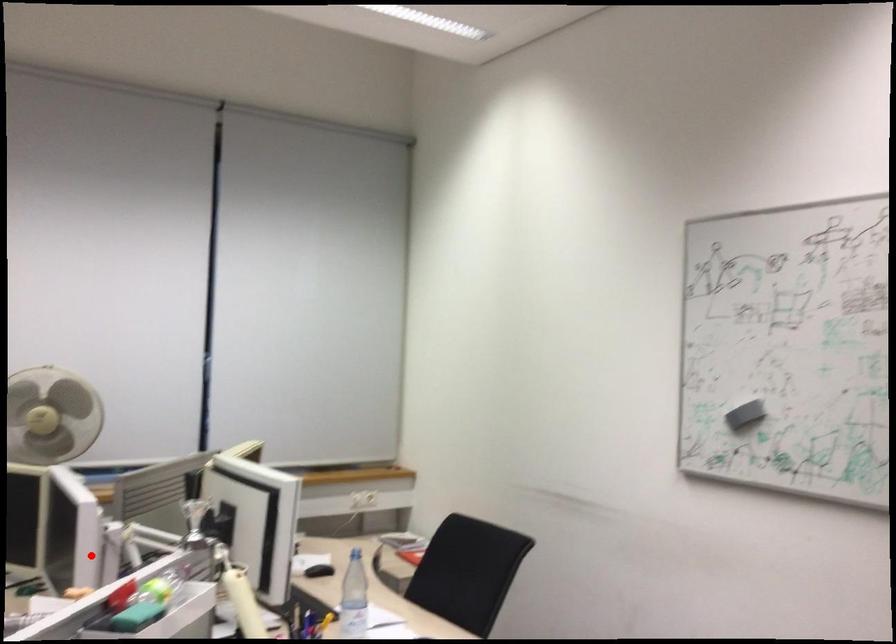
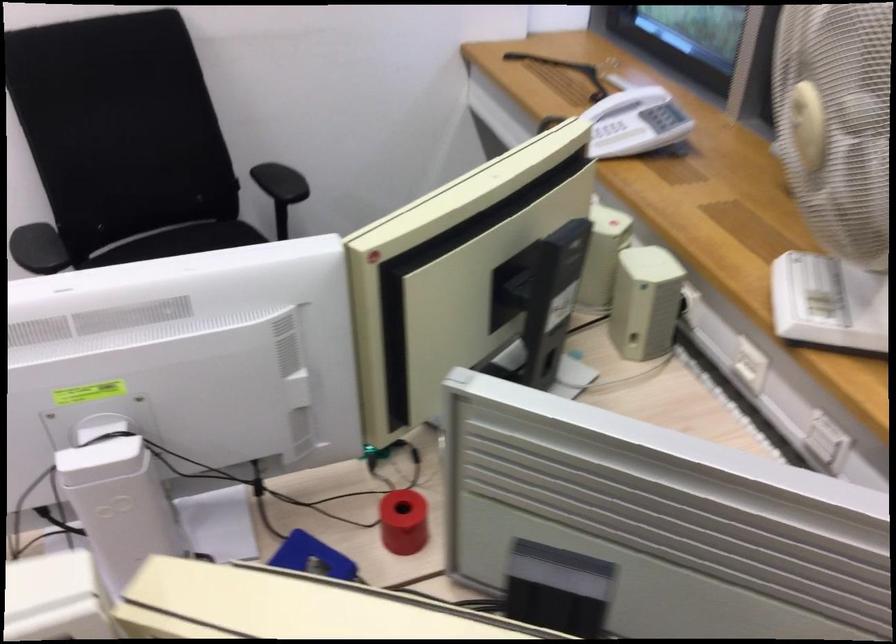
Question: I am providing you with two images of the same scene from different viewpoints. Given a red point in image1, look at the same physical point in image2. Is it:

Choices:
 (A) Closer to the viewpoint
 (B) Farther from the viewpoint

Answer: (A)